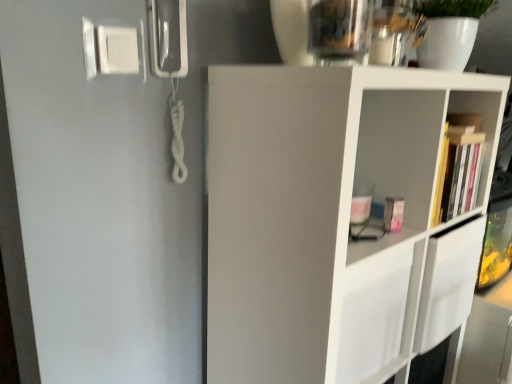
Question: In terms of height, does transparent glass vase at upper center look taller or shorter compared to hardcover book at right?

Choices:
 (A) tall
 (B) short

Answer: (B)

Question: Does point (358, 18) appear closer or farther from the camera than point (458, 200)?

Choices:
 (A) closer
 (B) farther

Answer: (A)

Question: Estimate the real-world distances between objects in this image. Which object is farther from the hardcover book at right?

Choices:
 (A) transparent glass vase at upper center
 (B) white matte shelf at center

Answer: (A)

Question: Which of these objects is positioned closest to the transparent glass vase at upper center?

Choices:
 (A) hardcover book at right
 (B) white matte shelf at center

Answer: (B)